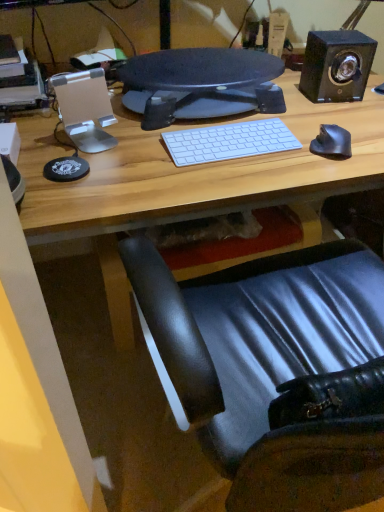
Locate an element on the screen. Image resolution: width=384 pixels, height=512 pixels. free space to the right of white matte keyboard at center is located at coordinates (314, 150).